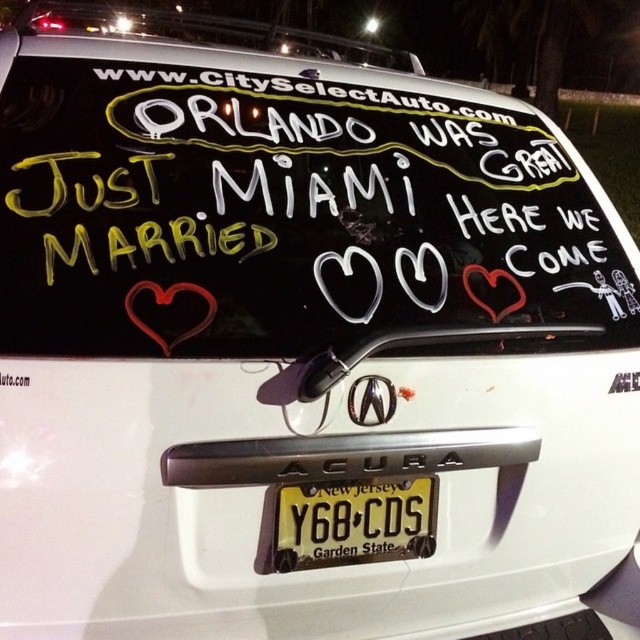
You are a photographer trying to capture the license plate and the heart decoration on the trunk of the Acura. Since the trunk is in the dark, you need to use a flashlight. To ensure both the yellow metallic license plate at center and the matte red heart at center right are clearly visible, where should you direct the flashlight?

You should direct the flashlight towards the matte red heart at center right because the yellow metallic license plate at center is positioned under it, and the light will reflect better on the metallic surface while illuminating the heart as well.